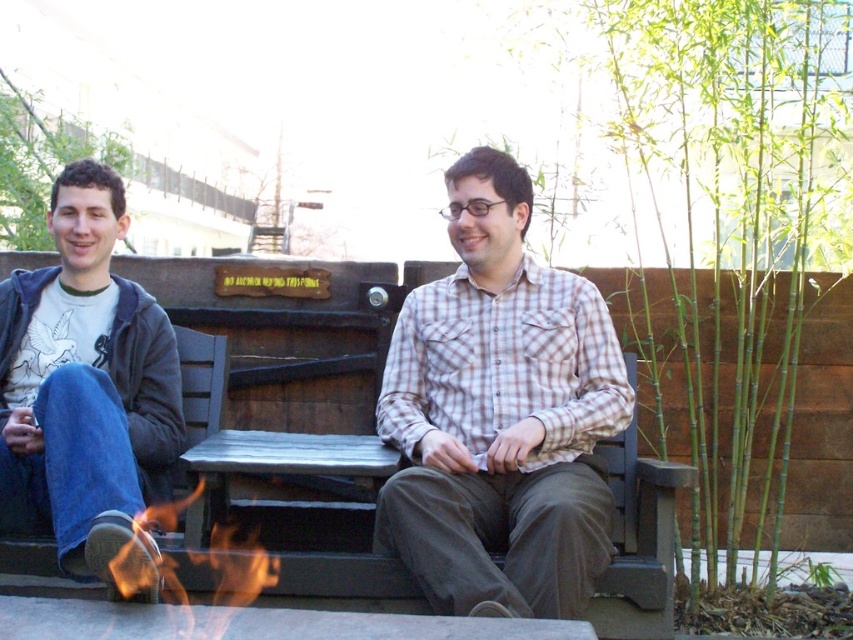
You are a photographer standing at the center of the scene. You want to capture a photo of the two people sitting on the wooden bench near the fire pit. The two people are the matte plaid shirt at center and another person. How far apart are they?

The matte plaid shirt at center and the other person are 6.26 feet apart.